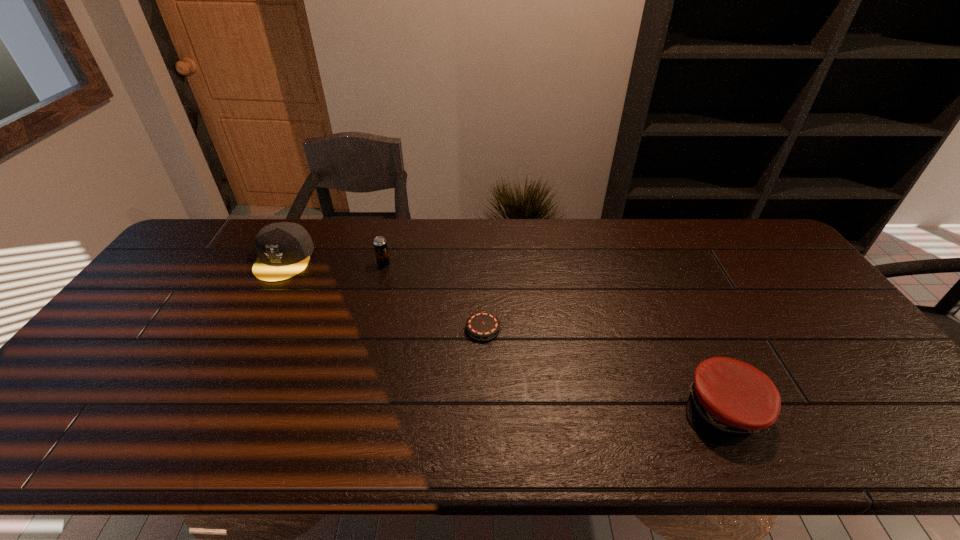
At what (x,y) coordinates should I click in order to perform the action: click on the farther cap. Please return your answer as a coordinate pair (x, y). Image resolution: width=960 pixels, height=540 pixels. Looking at the image, I should click on (284, 248).

What are the coordinates of `the leftmost object` in the screenshot? It's located at (284, 248).

Locate an element on the screen. beer can is located at coordinates (x=380, y=244).

Image resolution: width=960 pixels, height=540 pixels. What are the coordinates of `the nearest object` in the screenshot? It's located at (729, 400).

What are the coordinates of `the rightmost object` in the screenshot? It's located at (729, 400).

I want to click on the second nearest object, so click(481, 326).

I want to click on chocolate cake, so click(x=481, y=326).

Locate an element on the screen. blank space located 0.130m on the front-facing side of the left cap is located at coordinates (255, 313).

Locate an element on the screen. The width and height of the screenshot is (960, 540). vacant position located 0.390m on the front of the beer can is located at coordinates (357, 368).

At what (x,y) coordinates should I click in order to perform the action: click on vacant space located on the right of the shortest object. Please return your answer as a coordinate pair (x, y). Looking at the image, I should click on (543, 329).